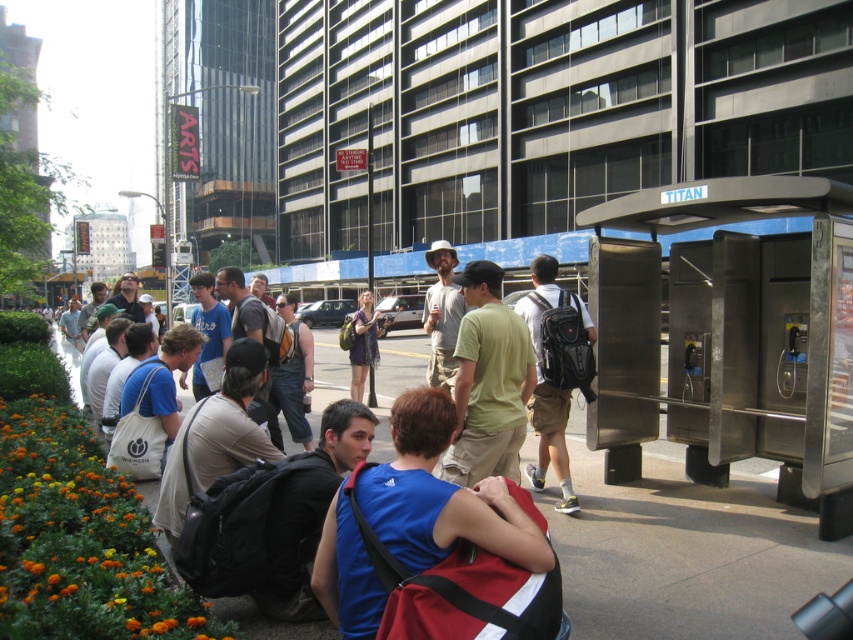
Which is below, dark gray backpack at center or matte black backpack at right?

Positioned lower is dark gray backpack at center.

Is dark gray backpack at center taller than matte black backpack at right?

No.

Where is `dark gray backpack at center`? This screenshot has height=640, width=853. dark gray backpack at center is located at coordinates (216, 436).

At what (x,y) coordinates should I click in order to perform the action: click on dark gray backpack at center. Please return your answer as a coordinate pair (x, y). Looking at the image, I should click on (216, 436).

Which is in front, point (703, 321) or point (372, 627)?

Point (372, 627)

Between metallic silver bus stop at right and blue fabric shirt at center, which one appears on the right side from the viewer's perspective?

metallic silver bus stop at right

This screenshot has height=640, width=853. Identify the location of metallic silver bus stop at right. (732, 332).

Between blue fabric shirt at center and denim pants at center, which one has less height?

Standing shorter between the two is denim pants at center.

From the picture: Between blue fabric shirt at center and denim pants at center, which one has more height?

With more height is blue fabric shirt at center.

This screenshot has height=640, width=853. What are the coordinates of `blue fabric shirt at center` in the screenshot? It's located at (440, 496).